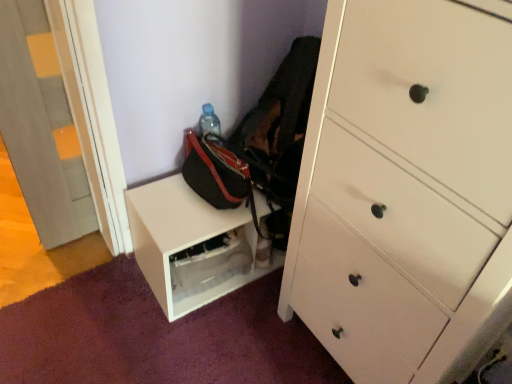
Question: From a real-world perspective, is black fabric messenger bag at lower center beneath matte gray door at left?

Choices:
 (A) yes
 (B) no

Answer: (A)

Question: Is black fabric messenger bag at lower center far from matte gray door at left?

Choices:
 (A) no
 (B) yes

Answer: (A)

Question: Considering the relative sizes of black fabric messenger bag at lower center and matte gray door at left in the image provided, is black fabric messenger bag at lower center smaller than matte gray door at left?

Choices:
 (A) no
 (B) yes

Answer: (A)

Question: Can you confirm if black fabric messenger bag at lower center is wider than matte gray door at left?

Choices:
 (A) yes
 (B) no

Answer: (A)

Question: Is black fabric messenger bag at lower center shorter than matte gray door at left?

Choices:
 (A) no
 (B) yes

Answer: (B)

Question: Does black fabric messenger bag at lower center have a larger size compared to matte gray door at left?

Choices:
 (A) yes
 (B) no

Answer: (A)

Question: From a real-world perspective, is white wood chest of drawers at right under black fabric messenger bag at lower center?

Choices:
 (A) yes
 (B) no

Answer: (B)

Question: Does white wood chest of drawers at right appear on the right side of black fabric messenger bag at lower center?

Choices:
 (A) no
 (B) yes

Answer: (B)

Question: From a real-world perspective, is white wood chest of drawers at right located higher than black fabric messenger bag at lower center?

Choices:
 (A) no
 (B) yes

Answer: (B)

Question: Does white wood chest of drawers at right have a lesser width compared to black fabric messenger bag at lower center?

Choices:
 (A) yes
 (B) no

Answer: (B)

Question: Does white wood chest of drawers at right appear on the left side of black fabric messenger bag at lower center?

Choices:
 (A) no
 (B) yes

Answer: (A)

Question: From the image's perspective, is white wood chest of drawers at right under black fabric messenger bag at lower center?

Choices:
 (A) no
 (B) yes

Answer: (B)

Question: Can you confirm if black fabric messenger bag at lower center is bigger than white matte shelf at lower center?

Choices:
 (A) no
 (B) yes

Answer: (B)